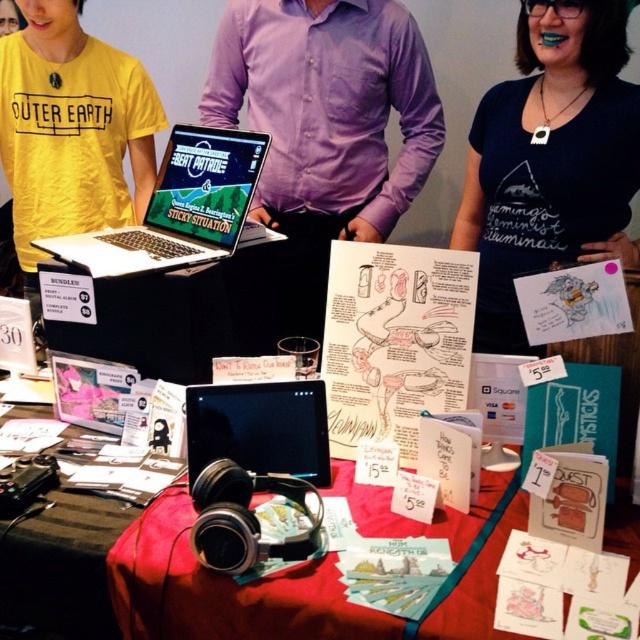
What object is located at the coordinates point (179, 208)?

The silver black laptop at center is located at point (179, 208).

You are helping set up a booth at an event and need to ensure that the purple cotton shirt at center and the black matte tablet at center are both visible to customers. Based on their sizes, which item should be placed higher on the table to ensure visibility?

The purple cotton shirt at center is much taller than the black matte tablet at center, so it should be placed higher on the table to ensure both items are visible.